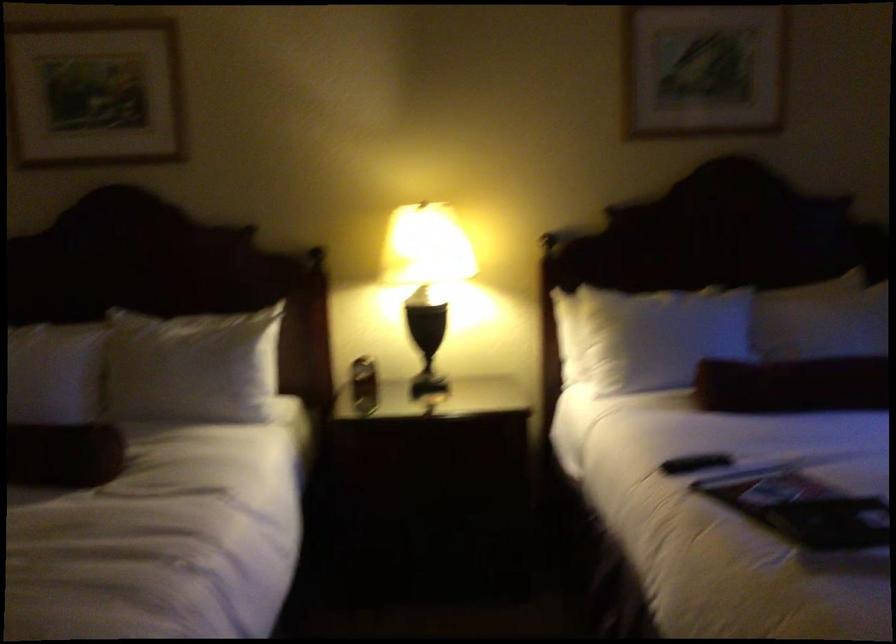
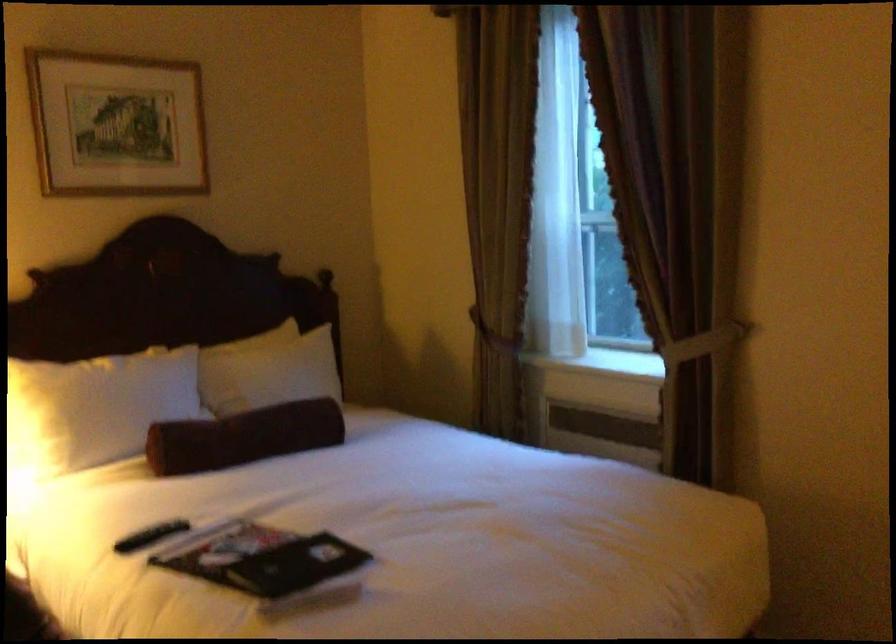
The point at (796, 384) is marked in the first image. Where is the corresponding point in the second image?

(243, 437)